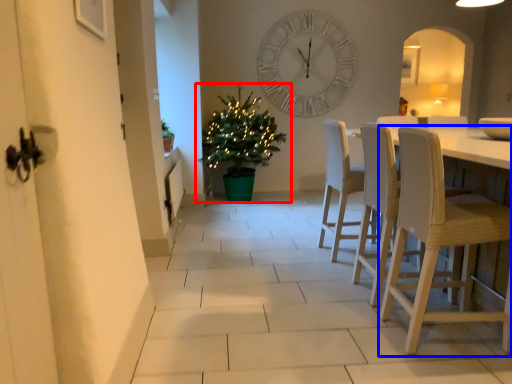
Question: Which point is further to the camera, houseplant (highlighted by a red box) or chair (highlighted by a blue box)?

Choices:
 (A) houseplant
 (B) chair

Answer: (A)